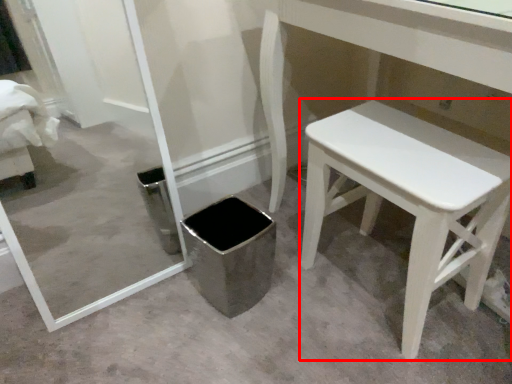
Question: From the image's perspective, considering the relative positions of stool (annotated by the red box) and potty in the image provided, where is stool (annotated by the red box) located with respect to the staircase?

Choices:
 (A) above
 (B) below

Answer: (A)